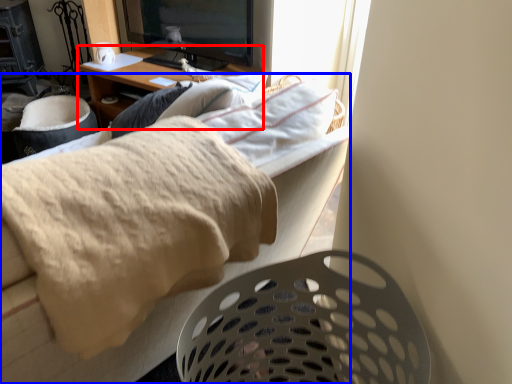
Question: Among these objects, which one is nearest to the camera, desk (highlighted by a red box) or furniture (highlighted by a blue box)?

Choices:
 (A) desk
 (B) furniture

Answer: (B)